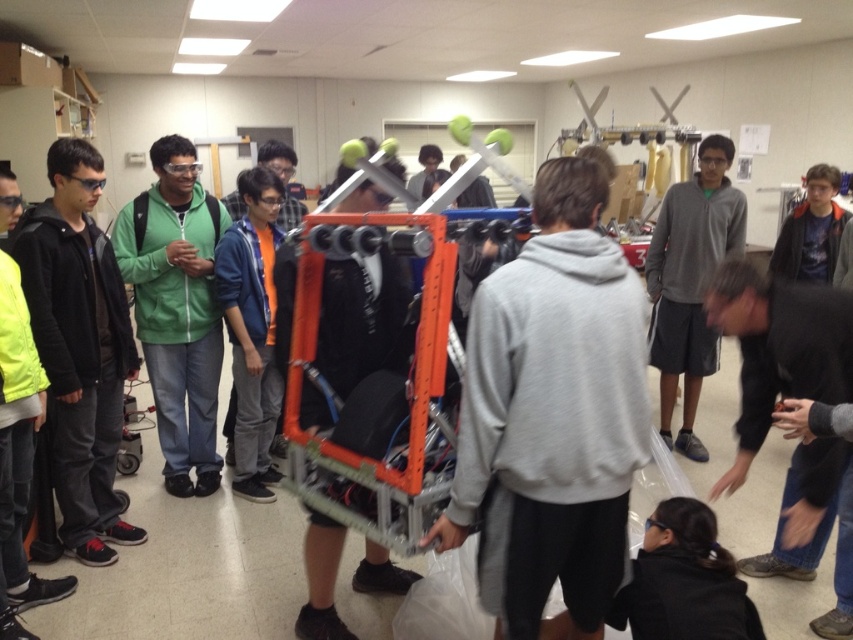
Question: Is green matte jacket at left to the left of neon yellow jacket at left from the viewer's perspective?

Choices:
 (A) no
 (B) yes

Answer: (A)

Question: Which object appears closest to the camera in this image?

Choices:
 (A) black fabric at lower right
 (B) orange metallic robot at center
 (C) green matte jacket at left
 (D) gray hoodie at center

Answer: (B)

Question: Considering the relative positions of black matte jacket at left and orange fabric shirt at center in the image provided, where is black matte jacket at left located with respect to orange fabric shirt at center?

Choices:
 (A) above
 (B) below

Answer: (B)

Question: Can you confirm if green matte jacket at left is thinner than gray hoodie at center?

Choices:
 (A) no
 (B) yes

Answer: (B)

Question: Which of the following is the closest to the observer?

Choices:
 (A) (798, 506)
 (B) (706, 243)
 (C) (277, 140)
 (D) (30, 285)

Answer: (A)

Question: Which point is closer to the camera taking this photo?

Choices:
 (A) click(x=480, y=440)
 (B) click(x=200, y=237)

Answer: (A)